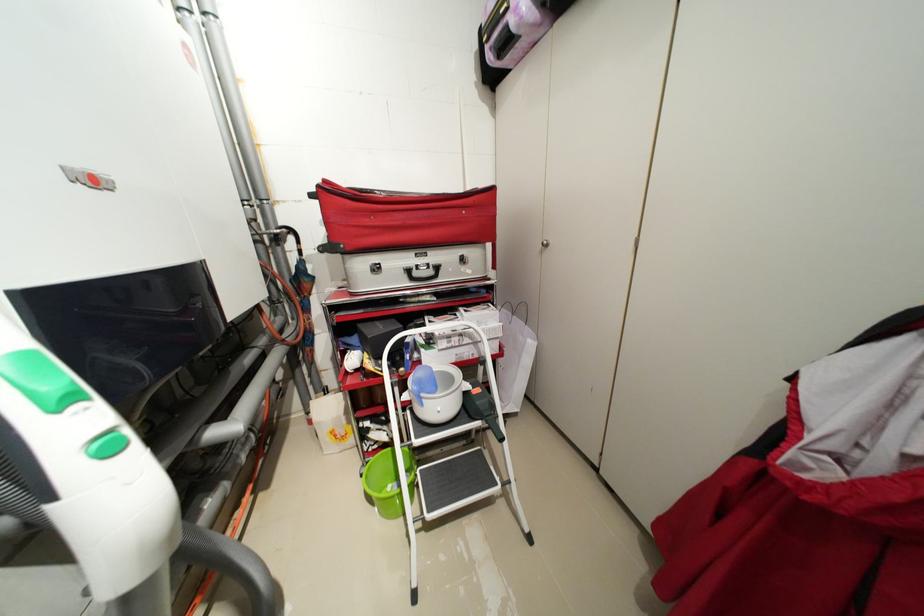
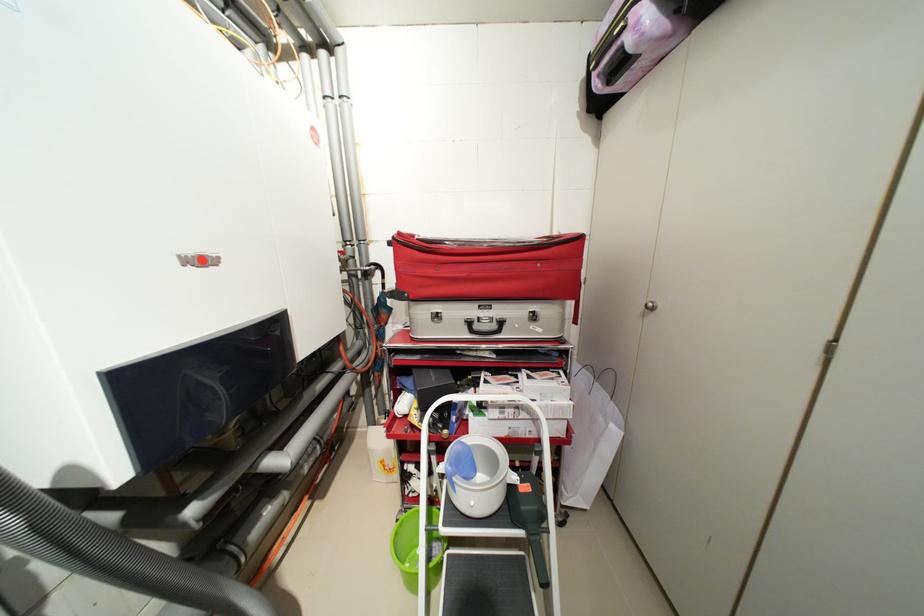
In the second image, find the point that corresponds to (x=482, y=344) in the first image.

(541, 421)